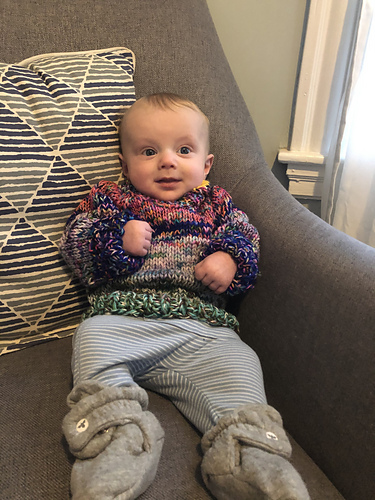
Where is `grey cloth chair`? This screenshot has height=500, width=375. grey cloth chair is located at coordinates (165, 58), (293, 370), (35, 391).